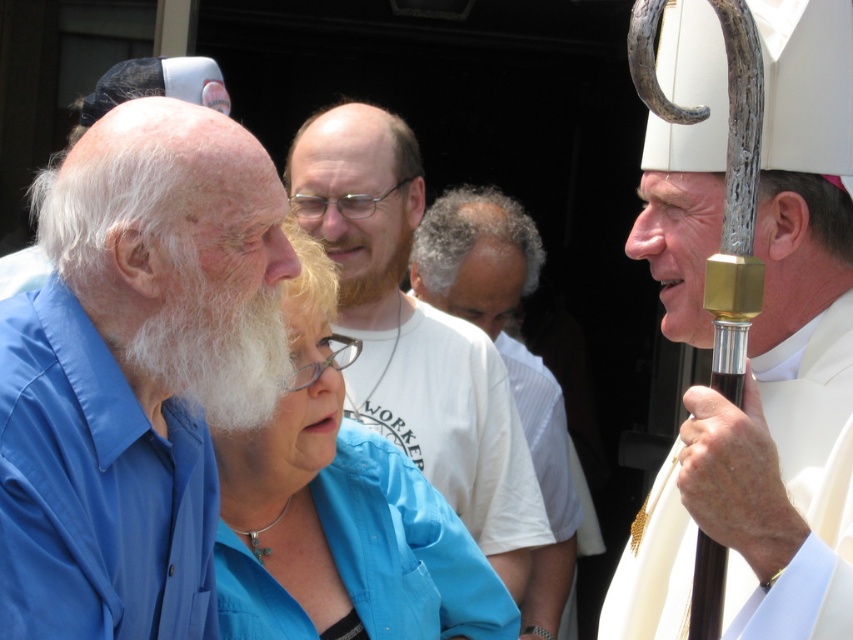
Question: Does blue cotton shirt at left have a smaller size compared to blue fabric shirt at center?

Choices:
 (A) yes
 (B) no

Answer: (A)

Question: Can you confirm if blue cotton shirt at left is smaller than blue fabric shirt at center?

Choices:
 (A) no
 (B) yes

Answer: (B)

Question: Which object appears farthest from the camera in this image?

Choices:
 (A) white matte staff at center
 (B) blue fabric shirt at center
 (C) white fluffy beard at left
 (D) white cotton shirt at center

Answer: (D)

Question: Does white cotton shirt at center appear over white fluffy beard at left?

Choices:
 (A) no
 (B) yes

Answer: (A)

Question: Which of the following is the farthest from the observer?

Choices:
 (A) white fluffy beard at left
 (B) white cotton shirt at center
 (C) blue fabric shirt at center
 (D) white matte staff at center

Answer: (B)

Question: Which object is positioned closest to the white matte staff at center?

Choices:
 (A) white fluffy beard at left
 (B) blue fabric shirt at center
 (C) white cotton shirt at center

Answer: (A)